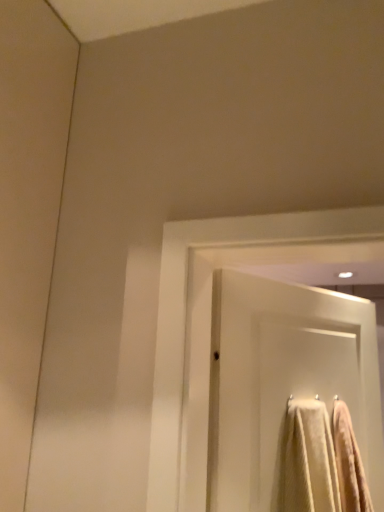
Describe the element at coordinates (284, 381) in the screenshot. This screenshot has height=512, width=384. I see `white matte towel rack at center` at that location.

Where is `white matte towel rack at center`? This screenshot has height=512, width=384. white matte towel rack at center is located at coordinates (284, 381).

Identify the location of white matte towel rack at center. The image size is (384, 512). (284, 381).